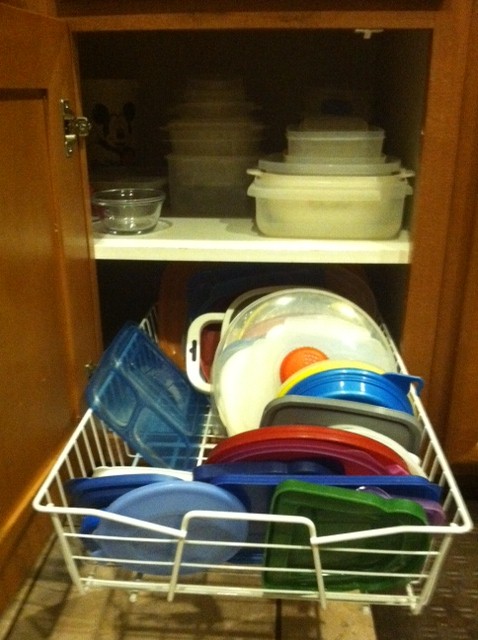
The height and width of the screenshot is (640, 478). I want to click on handle, so (308, 351).